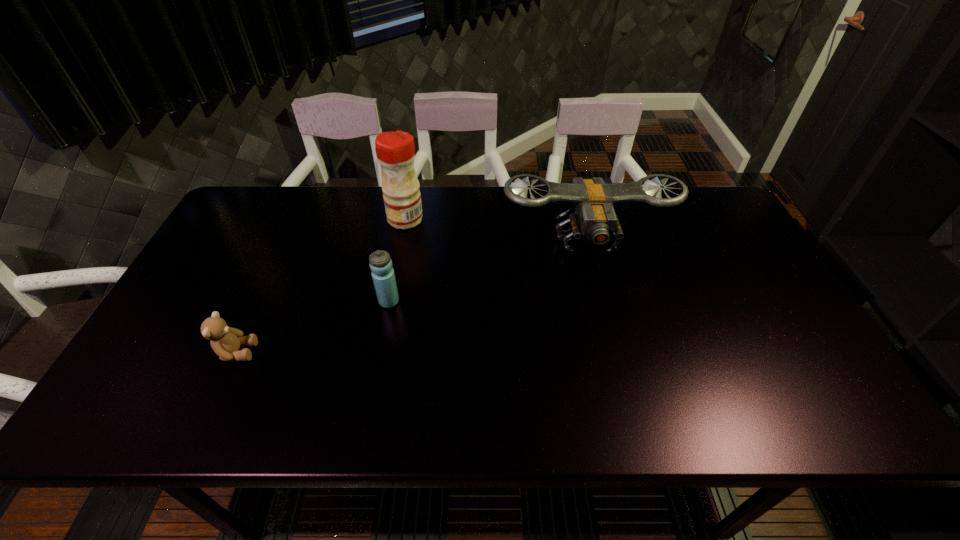
I want to click on vacant point located between the tallest object and the water bottle, so click(x=397, y=260).

Where is `free space that is in between the rightmost object and the teddy bear`? This screenshot has width=960, height=540. free space that is in between the rightmost object and the teddy bear is located at coordinates (412, 296).

Locate an element on the screen. vacant space in between the rightmost object and the nearest object is located at coordinates (412, 296).

Where is `empty space that is in between the water bottle and the leftmost object`? empty space that is in between the water bottle and the leftmost object is located at coordinates (313, 327).

This screenshot has width=960, height=540. I want to click on free point between the drone and the tallest object, so click(495, 230).

Identify the location of vacant space in between the condiment and the rightmost object. Image resolution: width=960 pixels, height=540 pixels. (495, 230).

Identify the location of vacant space that's between the rightmost object and the tallest object. (495, 230).

Identify which object is located as the nearest to the condiment. Please provide its 2D coordinates. Your answer should be formatted as a tuple, i.e. [(x, y)], where the tuple contains the x and y coordinates of a point satisfying the conditions above.

[(592, 216)]

Find the location of a particular element. Image resolution: width=960 pixels, height=540 pixels. object that is the closest to the tallest object is located at coordinates click(592, 216).

The image size is (960, 540). What are the coordinates of `free space that satisfies the following two spatial constraints: 1. on the front-facing side of the drone; 2. on the front-facing side of the nearest object` in the screenshot? It's located at (614, 352).